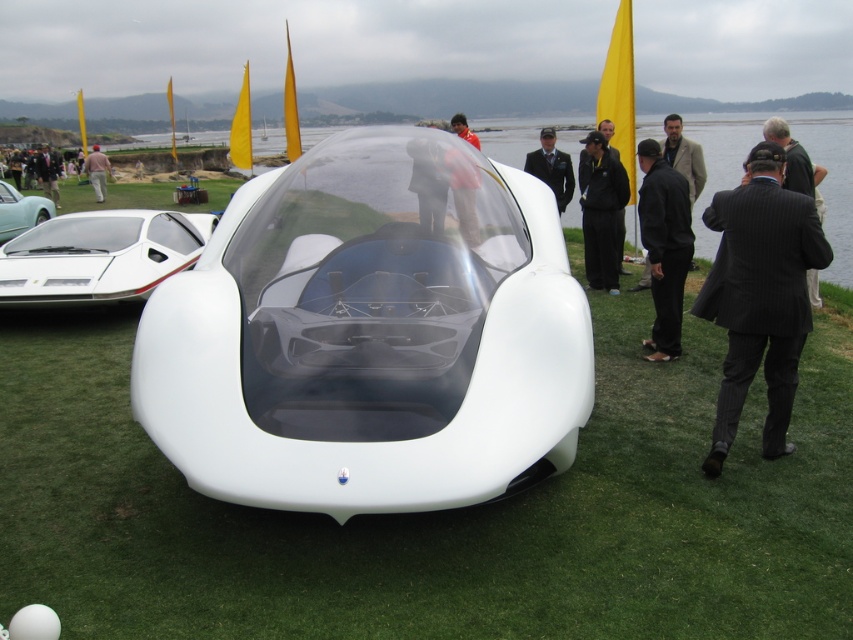
Question: Does black fabric jacket at center have a lesser width compared to dark suit at center?

Choices:
 (A) no
 (B) yes

Answer: (B)

Question: Which object is closer to the camera taking this photo?

Choices:
 (A) black leather pants at center
 (B) matte white car at left
 (C) red fabric jacket at center
 (D) white matte concept car at center

Answer: (D)

Question: Considering the relative positions of black leather pants at center and matte white car at left in the image provided, where is black leather pants at center located with respect to matte white car at left?

Choices:
 (A) right
 (B) left

Answer: (A)

Question: Based on their relative distances, which object is nearer to the black leather pants at center?

Choices:
 (A) brown leather jacket at center
 (B) white matte grass at center
 (C) black pinstripe suit at right

Answer: (C)

Question: Is black leather pants at center above matte black suit at center?

Choices:
 (A) yes
 (B) no

Answer: (B)

Question: Which of the following is the farthest from the observer?

Choices:
 (A) (476, 227)
 (B) (422, 164)

Answer: (B)